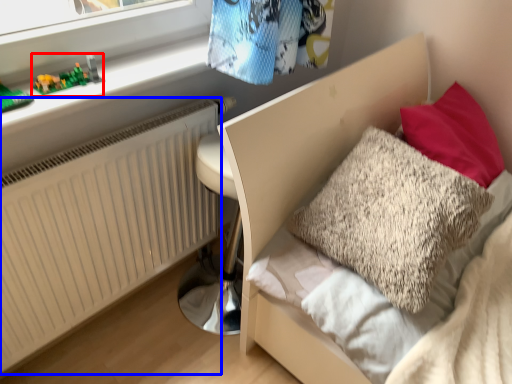
Question: Which object appears closest to the camera in this image, toy (highlighted by a red box) or radiator (highlighted by a blue box)?

Choices:
 (A) toy
 (B) radiator

Answer: (B)